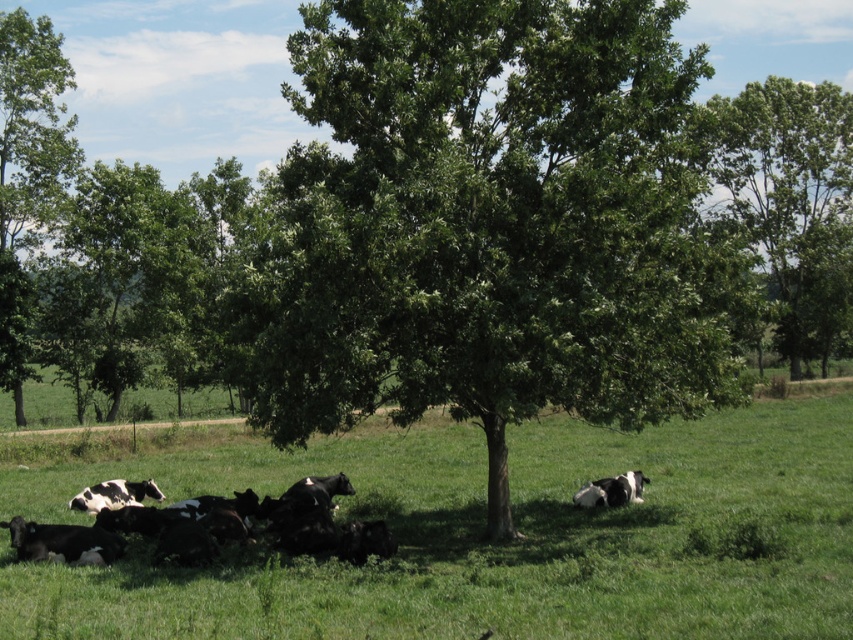
Question: Which point appears farthest from the camera in this image?

Choices:
 (A) (698, 520)
 (B) (322, 513)
 (C) (625, 497)

Answer: (C)

Question: Where is green leafy tree at upper right located in relation to green leafy tree at upper left in the image?

Choices:
 (A) left
 (B) right

Answer: (B)

Question: Can you confirm if green grass pasture at center is wider than green leafy tree at upper right?

Choices:
 (A) no
 (B) yes

Answer: (A)

Question: Which point is farther to the camera?

Choices:
 (A) green leafy tree at upper left
 (B) black and white fur at lower right
 (C) green grass pasture at center

Answer: (A)

Question: Which of these objects is positioned farthest from the green leafy tree at upper left?

Choices:
 (A) black and white fur at lower left
 (B) green leafy tree at upper right
 (C) green leafy tree at center

Answer: (B)

Question: Is green leafy tree at center to the left of black and white fur at lower right from the viewer's perspective?

Choices:
 (A) yes
 (B) no

Answer: (A)